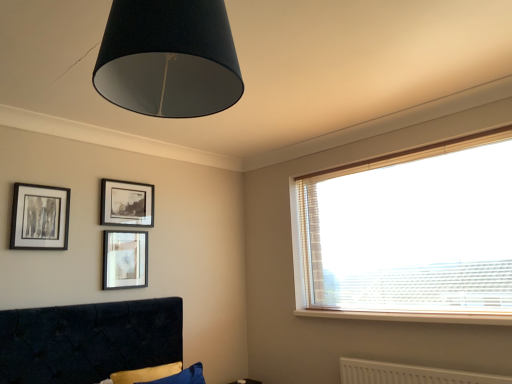
Find the location of a particular element. The width and height of the screenshot is (512, 384). vacant region above white textured radiator at lower right (from a real-world perspective) is located at coordinates (416, 358).